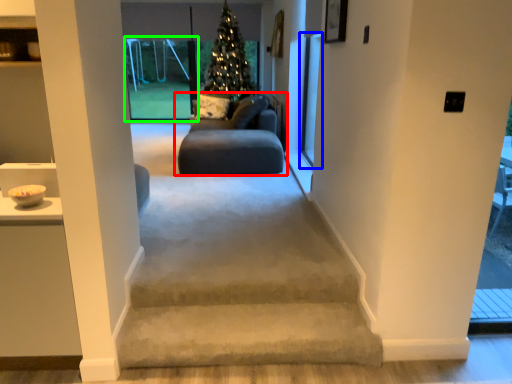
Question: Which object is the farthest from studio couch (highlighted by a red box)? Choose among these: screen door (highlighted by a blue box) or window (highlighted by a green box).

Choices:
 (A) screen door
 (B) window

Answer: (B)